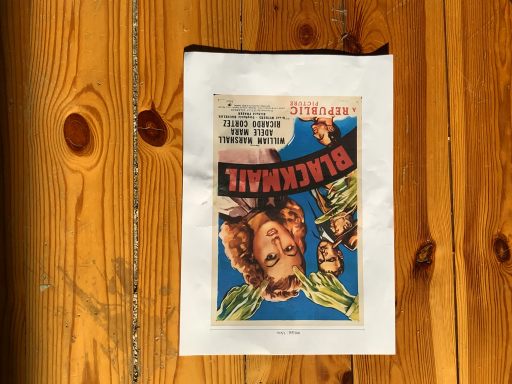
Describe the element at coordinates (287, 204) in the screenshot. I see `vintage paper poster at center` at that location.

You are a GUI agent. You are given a task and a screenshot of the screen. Output one action in this format:
    pyautogui.click(x=<x>, y=<y>)
    Task: Click on the vintage paper poster at center
    
    Given the screenshot: What is the action you would take?
    pyautogui.click(x=287, y=204)

Where is `vintage paper poster at center`? The width and height of the screenshot is (512, 384). vintage paper poster at center is located at coordinates (287, 204).